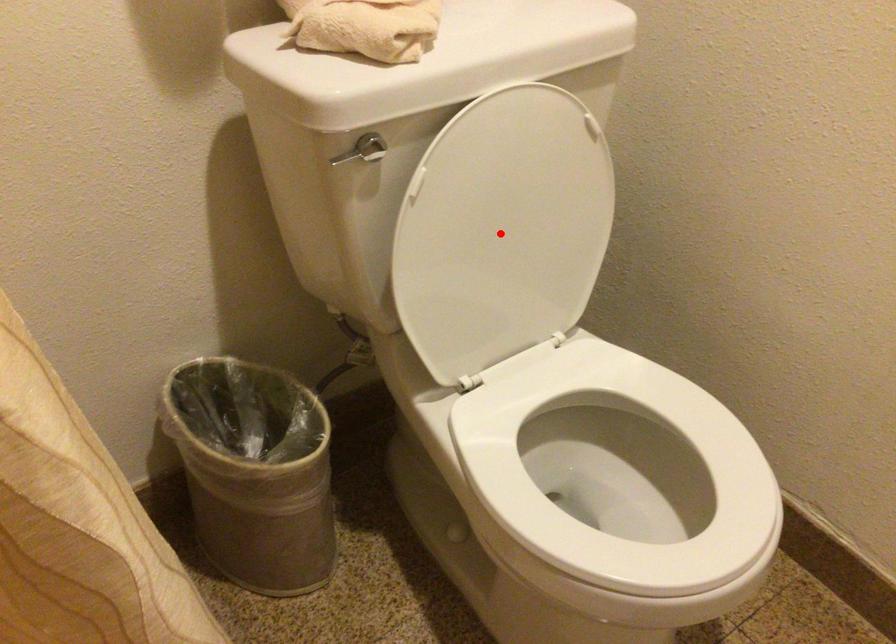
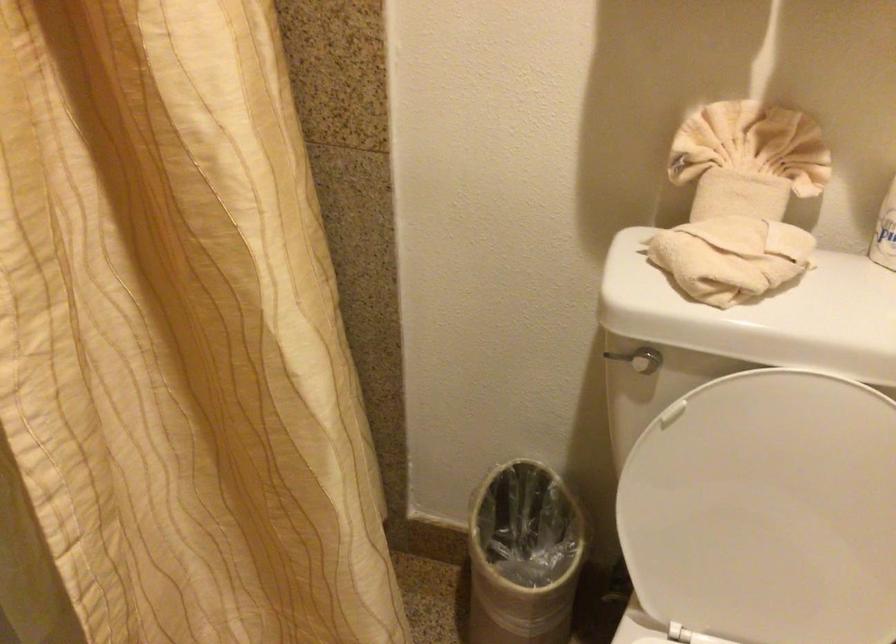
The point at the highlighted location is marked in the first image. Where is the corresponding point in the second image?

(767, 511)